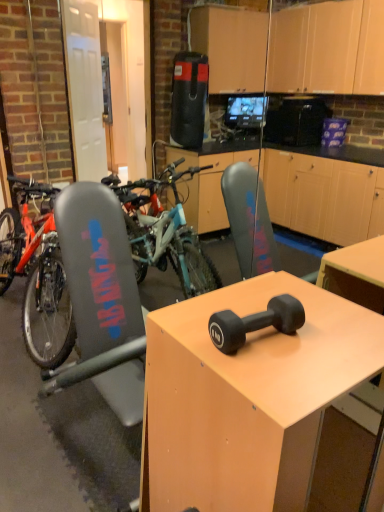
Measure the distance between black rubber dumbbell at center and camera.

They are 36.20 inches apart.

Identify the location of matte black dumbbell at center. The image size is (384, 512). (247, 397).

Is matte black dumbbell at center wider or thinner than black rubber dumbbell at center?

In the image, matte black dumbbell at center appears to be wider than black rubber dumbbell at center.

Is matte black dumbbell at center aimed at black rubber dumbbell at center?

No, matte black dumbbell at center is not facing towards black rubber dumbbell at center.

Measure the distance from matte black dumbbell at center to black rubber dumbbell at center.

They are 8.47 inches apart.

Considering the relative positions of matte black dumbbell at center and black rubber dumbbell at center in the image provided, is matte black dumbbell at center behind black rubber dumbbell at center?

No.

Is black rubber dumbbell at center located outside teal matte mountain bike at left?

Yes, black rubber dumbbell at center is located beyond the bounds of teal matte mountain bike at left.

From a real-world perspective, who is located higher, black rubber dumbbell at center or teal matte mountain bike at left?

black rubber dumbbell at center, from a real-world perspective.

Considering the sizes of objects black rubber dumbbell at center and teal matte mountain bike at left in the image provided, who is bigger, black rubber dumbbell at center or teal matte mountain bike at left?

Bigger between the two is teal matte mountain bike at left.

Find the location of `mountain bike behind the black rubber dumbbell at center`. mountain bike behind the black rubber dumbbell at center is located at coordinates (38, 273).

Considering the sizes of objects teal matte mountain bike at left and matte black dumbbell at center in the image provided, who is taller, teal matte mountain bike at left or matte black dumbbell at center?

teal matte mountain bike at left.

Is teal matte mountain bike at left looking in the opposite direction of matte black dumbbell at center?

No, teal matte mountain bike at left's orientation is not away from matte black dumbbell at center.

How different are the orientations of teal matte mountain bike at left and matte black dumbbell at center in degrees?

There is a 2.19-degree angle between the facing directions of teal matte mountain bike at left and matte black dumbbell at center.

Which is in front, teal matte mountain bike at left or matte black dumbbell at center?

matte black dumbbell at center is more forward.

Are black rubber dumbbell at center and matte black dumbbell at center beside each other?

black rubber dumbbell at center is not next to matte black dumbbell at center, and they're not touching.

In the scene shown: Between black rubber dumbbell at center and matte black dumbbell at center, which one is positioned in front?

matte black dumbbell at center is in front.

In the scene shown: From the image's perspective, is black rubber dumbbell at center located above or below matte black dumbbell at center?

From the image's perspective, black rubber dumbbell at center appears above matte black dumbbell at center.

From a real-world perspective, does black rubber dumbbell at center stand above matte black dumbbell at center?

Correct, in the physical world, black rubber dumbbell at center is higher than matte black dumbbell at center.

Does matte black dumbbell at center have a lesser width compared to teal matte mountain bike at left?

Yes, matte black dumbbell at center is thinner than teal matte mountain bike at left.

In the image, there is a teal matte mountain bike at left. At what (x,y) coordinates should I click in order to perform the action: click on desk below it (from a real-world perspective). Please return your answer as a coordinate pair (x, y). This screenshot has width=384, height=512. Looking at the image, I should click on (247, 397).

Does matte black dumbbell at center touch teal matte mountain bike at left?

matte black dumbbell at center and teal matte mountain bike at left are clearly separated.

What's the angular difference between matte black dumbbell at center and teal matte mountain bike at left's facing directions?

There is a 2.19-degree angle between the facing directions of matte black dumbbell at center and teal matte mountain bike at left.

Is teal matte mountain bike at left beside black rubber dumbbell at center?

There is a gap between teal matte mountain bike at left and black rubber dumbbell at center.

Considering the positions of objects teal matte mountain bike at left and black rubber dumbbell at center in the image provided, who is in front, teal matte mountain bike at left or black rubber dumbbell at center?

black rubber dumbbell at center is in front.

Could you tell me if teal matte mountain bike at left is turned towards black rubber dumbbell at center?

No, teal matte mountain bike at left is not turned towards black rubber dumbbell at center.

Does teal matte mountain bike at left appear on the right side of black rubber dumbbell at center?

No.

Identify the location of desk below the black rubber dumbbell at center (from the image's perspective). (247, 397).

Identify the location of mountain bike above the black rubber dumbbell at center (from the image's perspective). (38, 273).

Based on their spatial positions, is black rubber dumbbell at center or matte black dumbbell at center further from teal matte mountain bike at left?

black rubber dumbbell at center is further to teal matte mountain bike at left.

Based on their spatial positions, is matte black dumbbell at center or black rubber dumbbell at center further from teal matte mountain bike at left?

Among the two, black rubber dumbbell at center is located further to teal matte mountain bike at left.

When comparing their distances from black rubber dumbbell at center, does matte black dumbbell at center or teal matte mountain bike at left seem closer?

matte black dumbbell at center.

Based on their spatial positions, is teal matte mountain bike at left or black rubber dumbbell at center closer to matte black dumbbell at center?

black rubber dumbbell at center is closer to matte black dumbbell at center.

From the picture: Estimate the real-world distances between objects in this image. Which object is closer to black rubber dumbbell at center, teal matte mountain bike at left or matte black dumbbell at center?

matte black dumbbell at center lies closer to black rubber dumbbell at center than the other object.

Considering their positions, is black rubber dumbbell at center positioned further to matte black dumbbell at center than teal matte mountain bike at left?

Among the two, teal matte mountain bike at left is located further to matte black dumbbell at center.

Find the location of a particular element. The image size is (384, 512). dumbbell between teal matte mountain bike at left and matte black dumbbell at center from left to right is located at coordinates (255, 323).